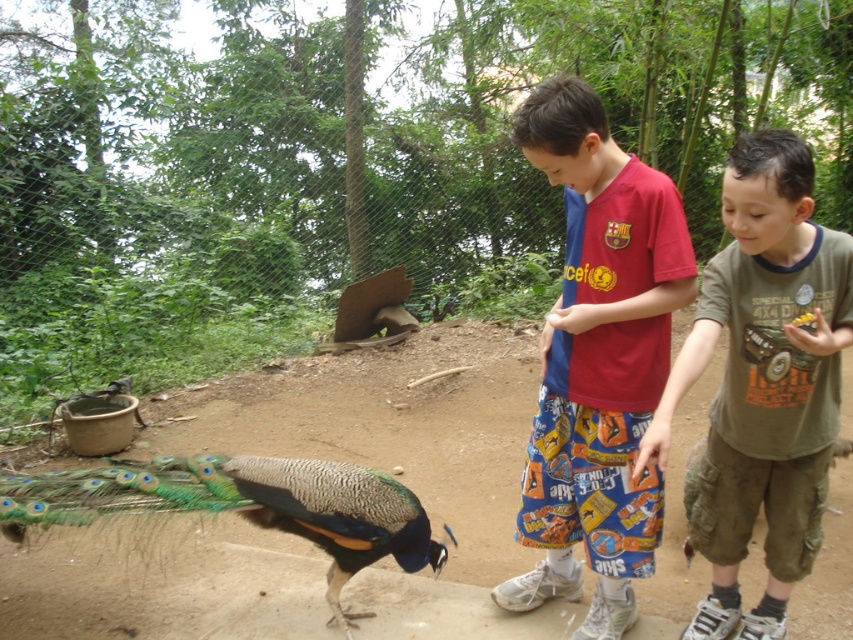
Who is shorter, red cotton shirt at center or shiny iridescent peacock at lower left?

With less height is shiny iridescent peacock at lower left.

Is red cotton shirt at center thinner than shiny iridescent peacock at lower left?

Correct, red cotton shirt at center's width is less than shiny iridescent peacock at lower left's.

What do you see at coordinates (596, 360) in the screenshot? The width and height of the screenshot is (853, 640). I see `red cotton shirt at center` at bounding box center [596, 360].

Identify the location of red cotton shirt at center. The height and width of the screenshot is (640, 853). (596, 360).

Is red cotton shirt at center shorter than green cargo shorts at lower right?

No.

The width and height of the screenshot is (853, 640). What do you see at coordinates (596, 360) in the screenshot?
I see `red cotton shirt at center` at bounding box center [596, 360].

Image resolution: width=853 pixels, height=640 pixels. I want to click on red cotton shirt at center, so click(x=596, y=360).

Does point (755, 611) come behind point (310, 525)?

Yes, it is.

Does green cargo shorts at lower right have a lesser height compared to shiny iridescent peacock at lower left?

No.

Is point (764, 429) positioned in front of point (142, 467)?

Yes.

Locate an element on the screen. The image size is (853, 640). green cargo shorts at lower right is located at coordinates (762, 384).